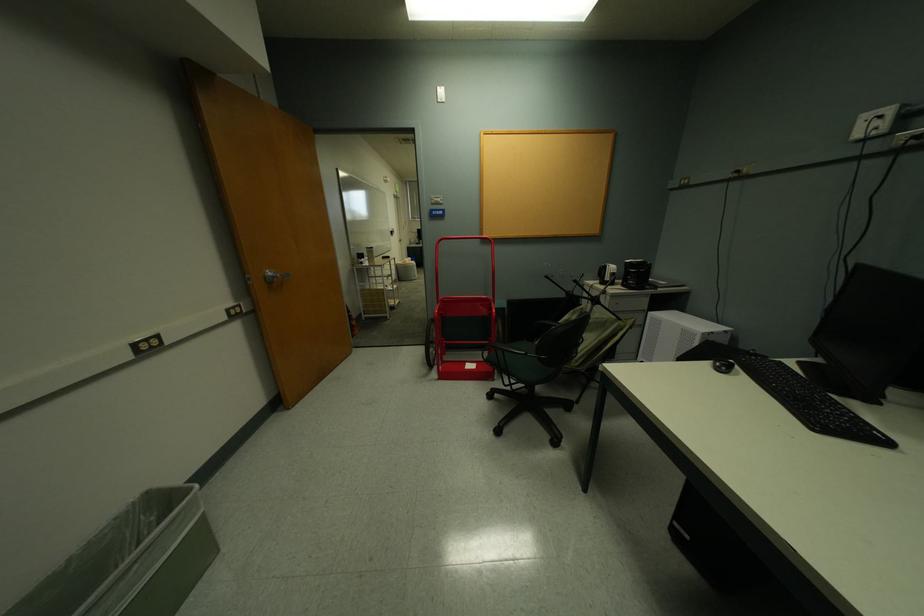
Where is `white light switch`? white light switch is located at coordinates (873, 122).